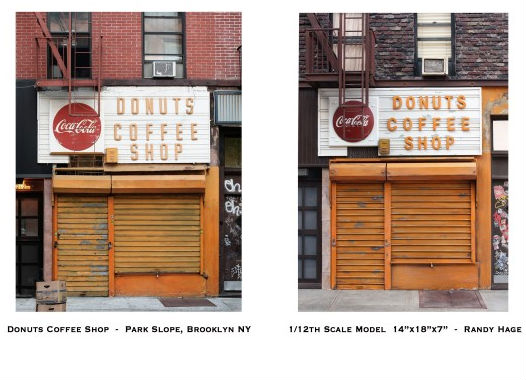
Where is `glass`? The width and height of the screenshot is (526, 380). glass is located at coordinates (32, 209).